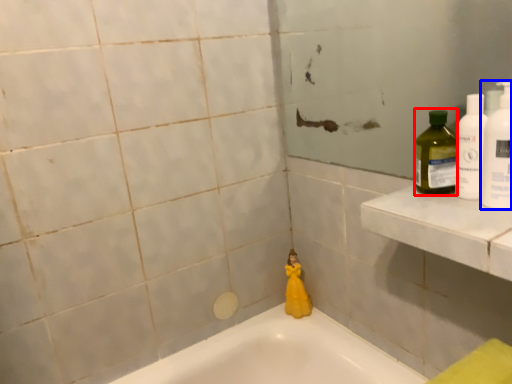
Question: Which point is further to the camera, cleaning product (highlighted by a red box) or cleaning product (highlighted by a blue box)?

Choices:
 (A) cleaning product
 (B) cleaning product

Answer: (A)